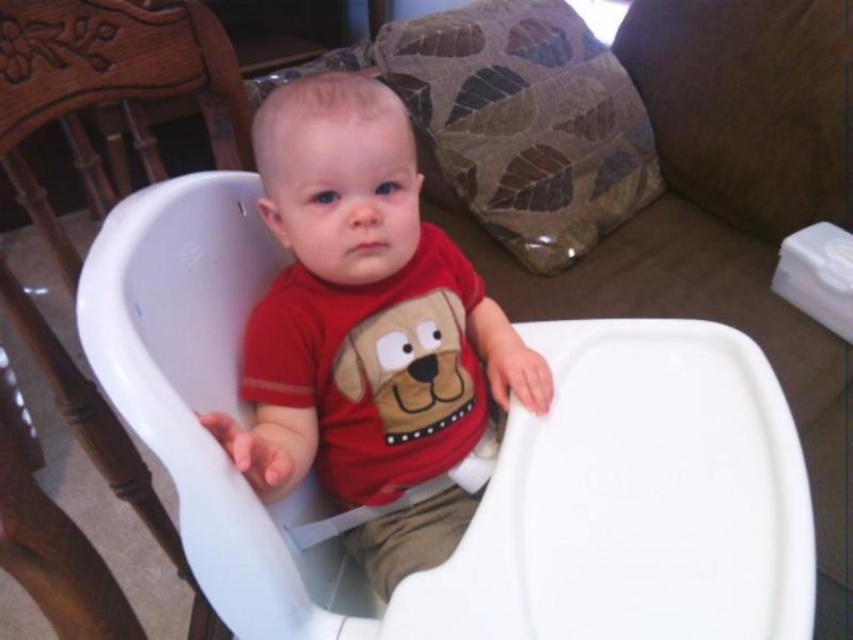
Where is the matte red shirt at center located in the image?

The matte red shirt at center is located at point (369, 332) in the image.

You are taking a photo of a baby in a white high chair. You notice two points in the image labeled as point 1 and point 2. The first point is at coordinates (196, 228) and the second point is at (62, 570). Based on their positions, which point is closer to the camera?

Point 1 at coordinates (196, 228) is closer to the camera than point 2 at (62, 570) because it is further to the camera.

You are a parent trying to place a toy between the white plastic feeding chair at center and the matte red shirt at center. The toy is 10 centimeters long. Can you fit the toy between them without moving either object?

The distance between the white plastic feeding chair at center and the matte red shirt at center is 8.98 centimeters. Since the toy is 10 centimeters long, it cannot fit between them without moving either object.